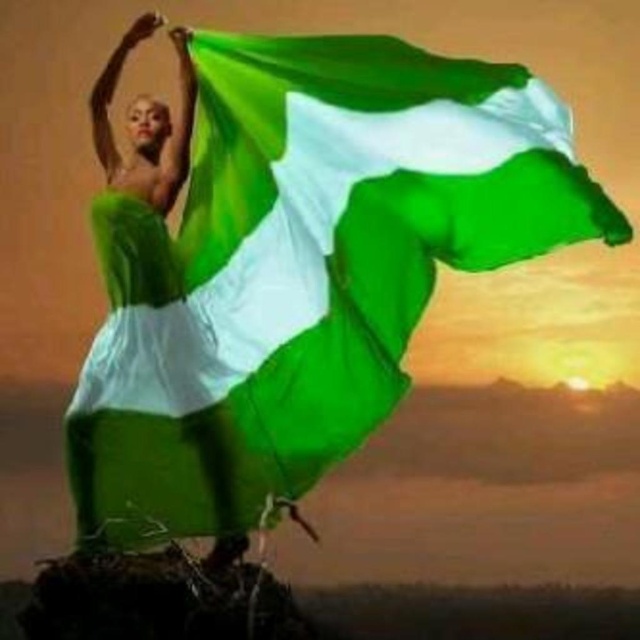
Question: Which point is farther to the camera?

Choices:
 (A) (348, 212)
 (B) (180, 180)

Answer: (B)

Question: Is green fabric flag at center positioned in front of matte green fabric at center?

Choices:
 (A) no
 (B) yes

Answer: (B)

Question: Which point is farther to the camera?

Choices:
 (A) matte green fabric at center
 (B) green fabric flag at center

Answer: (A)

Question: Does green fabric flag at center appear over matte green fabric at center?

Choices:
 (A) no
 (B) yes

Answer: (B)

Question: Can you confirm if green fabric flag at center is smaller than matte green fabric at center?

Choices:
 (A) no
 (B) yes

Answer: (A)

Question: Which point is closer to the camera taking this photo?

Choices:
 (A) (218, 228)
 (B) (163, 116)

Answer: (A)